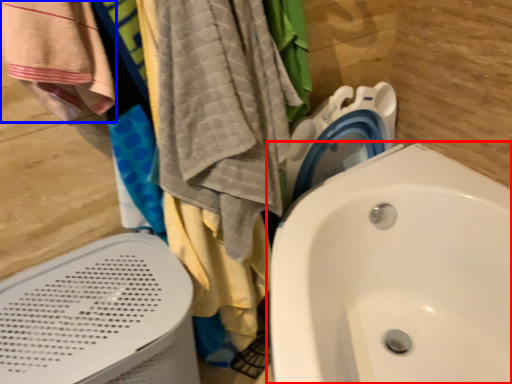
Question: Which of the following is the farthest to the observer, sink (highlighted by a red box) or beach towel (highlighted by a blue box)?

Choices:
 (A) sink
 (B) beach towel

Answer: (B)